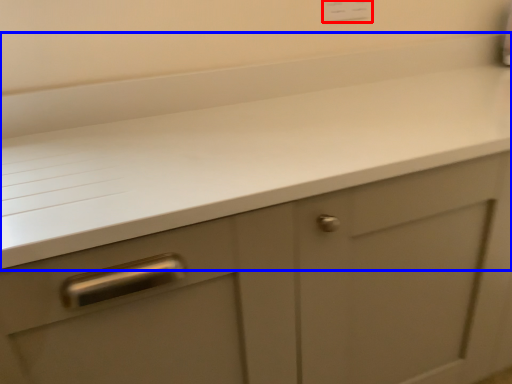
Question: Which object appears closest to the camera in this image, electric outlet (highlighted by a red box) or countertop (highlighted by a blue box)?

Choices:
 (A) electric outlet
 (B) countertop

Answer: (B)